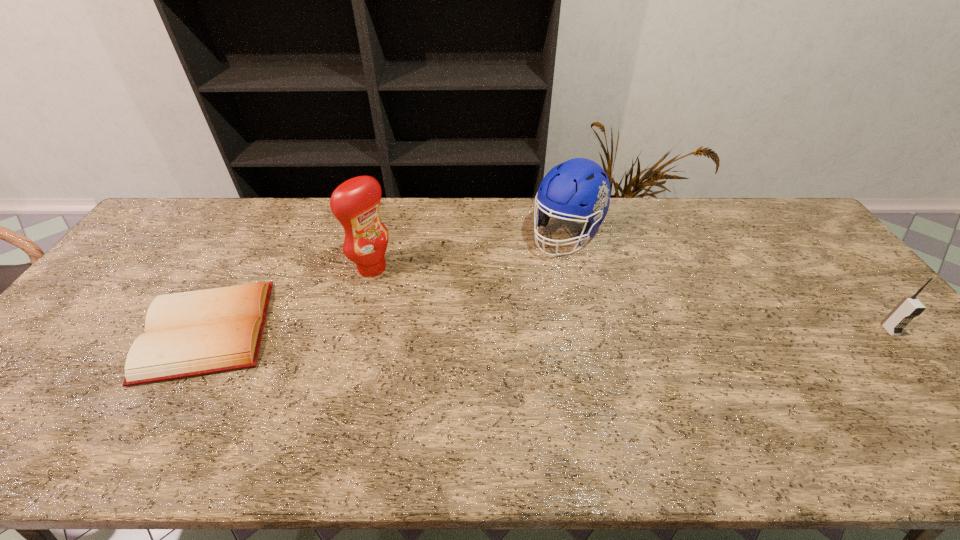
This screenshot has width=960, height=540. Identify the location of vacant space located 0.260m on the face guard of the second tallest object. (500, 304).

Find the location of a particular element. free space located 0.260m on the face guard of the second tallest object is located at coordinates (500, 304).

Identify the location of free spot located 0.340m on the label side of the third object from right to left. (472, 336).

Identify the location of free point located on the label side of the third object from right to left. (429, 307).

Identify the location of free space located 0.090m on the label side of the third object from right to left. This screenshot has height=540, width=960. (406, 292).

Identify the location of object located in the far edge section of the desktop. click(579, 188).

The width and height of the screenshot is (960, 540). What are the coordinates of `object that is at the near edge` in the screenshot? It's located at (200, 332).

Where is `object located in the right edge section of the desktop`? The height and width of the screenshot is (540, 960). object located in the right edge section of the desktop is located at coordinates (909, 307).

Where is `vacant space at the far edge of the desktop`? The height and width of the screenshot is (540, 960). vacant space at the far edge of the desktop is located at coordinates (526, 201).

Where is `vacant space at the near edge`? This screenshot has height=540, width=960. vacant space at the near edge is located at coordinates (591, 382).